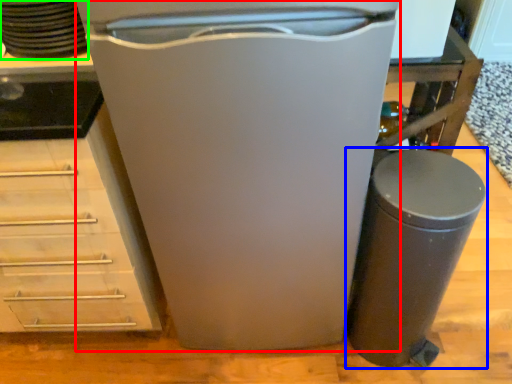
Question: Which is nearer to the home appliance (highlighted by a red box)? waste container (highlighted by a blue box) or appliance (highlighted by a green box).

Choices:
 (A) waste container
 (B) appliance

Answer: (A)